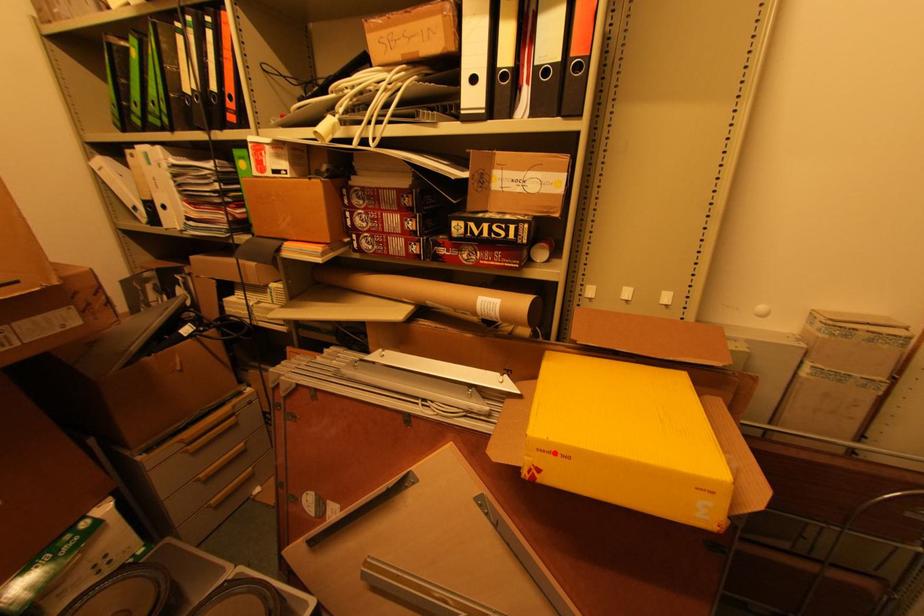
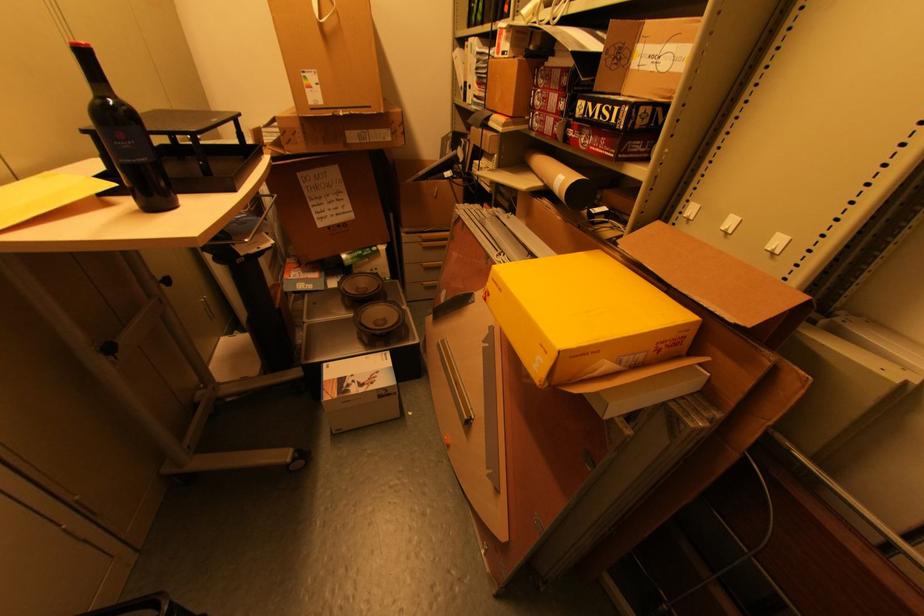
Find the pixel in the second image that matches the highlighted location in the first image.

(499, 284)